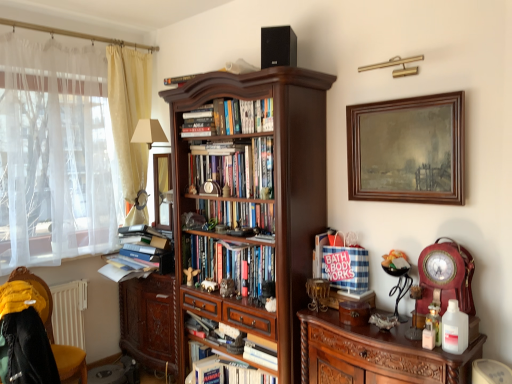
What is the approximate height of transparent plastic bottle at right?

It is 7.89 inches.

What do you see at coordinates (237, 169) in the screenshot? The width and height of the screenshot is (512, 384). I see `hardcover books at center, arranged as the second book when viewed from the top` at bounding box center [237, 169].

What do you see at coordinates (150, 321) in the screenshot? The image size is (512, 384). I see `carved wood cabinet at lower left` at bounding box center [150, 321].

Locate an element on the screen. The image size is (512, 384). transparent plastic bottle at right is located at coordinates (455, 329).

Considering the sizes of wooden clock at right, the 2th picture frame when ordered from top to bottom, and brown carved wooden cabinet at lower right in the image, is wooden clock at right, the 2th picture frame when ordered from top to bottom, taller or shorter than brown carved wooden cabinet at lower right?

In the image, wooden clock at right, the 2th picture frame when ordered from top to bottom, appears to be shorter than brown carved wooden cabinet at lower right.

The height and width of the screenshot is (384, 512). Find the location of `cabinetry below the wooden clock at right, the 2th picture frame when ordered from top to bottom (from a real-world perspective)`. cabinetry below the wooden clock at right, the 2th picture frame when ordered from top to bottom (from a real-world perspective) is located at coordinates (375, 355).

Is wooden clock at right, the 2th picture frame when ordered from top to bottom, with brown carved wooden cabinet at lower right?

No, wooden clock at right, the 2th picture frame when ordered from top to bottom, is not next to brown carved wooden cabinet at lower right.

Can you confirm if hardcover books at center, the 5th book from the top, is taller than yellow fabric chair at lower left?

Incorrect, the height of hardcover books at center, the 5th book from the top, is not larger of that of yellow fabric chair at lower left.

Is hardcover books at center, the first book ordered from the bottom, aimed at yellow fabric chair at lower left?

No, hardcover books at center, the first book ordered from the bottom, is not oriented towards yellow fabric chair at lower left.

Is hardcover books at center, the first book ordered from the bottom, outside of yellow fabric chair at lower left?

Yes, hardcover books at center, the first book ordered from the bottom, is not within yellow fabric chair at lower left.

Considering the points (218, 374) and (287, 36), which point is behind, point (218, 374) or point (287, 36)?

Positioned behind is point (218, 374).

Looking at this image, which of these two, hardcover books at center, the first book ordered from the bottom, or black matte speaker at upper center, is smaller?

hardcover books at center, the first book ordered from the bottom, is smaller.

Is hardcover books at center, the first book ordered from the bottom, beside black matte speaker at upper center?

No.

Would you say black matte speaker at upper center is part of hardcover books at center, the 5th book from the top,'s contents?

No, black matte speaker at upper center is located outside of hardcover books at center, the 5th book from the top.

Which of these two, wooden clock at right, which is the 1th picture frame from bottom to top, or hardcover books at center, acting as the 3th book starting from the bottom, is thinner?

wooden clock at right, which is the 1th picture frame from bottom to top, is thinner.

Which of these two, wooden clock at right, the 2th picture frame when ordered from top to bottom, or hardcover books at center, which is counted as the third book, starting from the top, is smaller?

wooden clock at right, the 2th picture frame when ordered from top to bottom.

Is wooden clock at right, the 2th picture frame when ordered from top to bottom, far away from hardcover books at center, which is counted as the third book, starting from the top?

wooden clock at right, the 2th picture frame when ordered from top to bottom, is near hardcover books at center, which is counted as the third book, starting from the top, not far away.

From a real-world perspective, is wooden clock at right, the 2th picture frame when ordered from top to bottom, above or below hardcover books at center, which is counted as the third book, starting from the top?

wooden clock at right, the 2th picture frame when ordered from top to bottom, is below hardcover books at center, which is counted as the third book, starting from the top.

Is hardcover books at center, which appears as the fifth book when ordered from the bottom, aimed at black matte speaker at upper center?

No, hardcover books at center, which appears as the fifth book when ordered from the bottom, does not turn towards black matte speaker at upper center.

Is hardcover books at center, which is counted as the first book, starting from the top, shorter than black matte speaker at upper center?

Yes.

From the picture: Are hardcover books at center, which is counted as the first book, starting from the top, and black matte speaker at upper center making contact?

No, hardcover books at center, which is counted as the first book, starting from the top, is not in contact with black matte speaker at upper center.

Would you say hardcover books at center, which appears as the fifth book when ordered from the bottom, is inside or outside black matte speaker at upper center?

hardcover books at center, which appears as the fifth book when ordered from the bottom, lies outside black matte speaker at upper center.

Is dark wood bookcase at center facing away from transparent glass window screen at left?

No, transparent glass window screen at left is not at the back of dark wood bookcase at center.

From the image's perspective, would you say dark wood bookcase at center is shown under transparent glass window screen at left?

Yes, from the image's perspective, dark wood bookcase at center is below transparent glass window screen at left.

Considering the sizes of objects dark wood bookcase at center and transparent glass window screen at left in the image provided, who is smaller, dark wood bookcase at center or transparent glass window screen at left?

transparent glass window screen at left is smaller.

Based on the photo, from a real-world perspective, is dark wood bookcase at center positioned over transparent glass window screen at left based on gravity?

Actually, dark wood bookcase at center is physically below transparent glass window screen at left in the real world.

Could wooden clock at right, the 2th picture frame when ordered from top to bottom, be considered to be inside hardcover books at center, which appears as the fifth book when ordered from the bottom?

Definitely not — wooden clock at right, the 2th picture frame when ordered from top to bottom, is not inside hardcover books at center, which appears as the fifth book when ordered from the bottom.

Is hardcover books at center, which is counted as the first book, starting from the top, next to wooden clock at right, which is the 1th picture frame from bottom to top, and touching it?

hardcover books at center, which is counted as the first book, starting from the top, and wooden clock at right, which is the 1th picture frame from bottom to top, are not in contact.

Visually, is hardcover books at center, which appears as the fifth book when ordered from the bottom, positioned to the left or to the right of wooden clock at right, which is the 1th picture frame from bottom to top?

hardcover books at center, which appears as the fifth book when ordered from the bottom, is to the left of wooden clock at right, which is the 1th picture frame from bottom to top.

I want to click on the 2nd picture frame counting from the right of the hardcover books at center, which is counted as the first book, starting from the top, so click(446, 276).

The image size is (512, 384). In order to click on cabinetry on the left of wooden clock at right, which is the 1th picture frame from bottom to top in this screenshot , I will do `click(375, 355)`.

From the yellow fabric chair at lower left, count 3rd books backward and point to it. Please provide its 2D coordinates.

[(226, 369)]

Considering their positions, is wooden framed painting at upper right, marked as the second picture frame in a bottom-to-top arrangement, positioned further to wooden clock at right, which is the 1th picture frame from bottom to top, than yellow fabric curtain at left, marked as the second curtain in a left-to-right arrangement?

yellow fabric curtain at left, marked as the second curtain in a left-to-right arrangement.

Estimate the real-world distances between objects in this image. Which object is further from black matte speaker at upper center, carved wood cabinet at lower left or dark wood bookcase at center?

carved wood cabinet at lower left lies further to black matte speaker at upper center than the other object.

From the picture: Based on their spatial positions, is hardcover books at center, which is counted as the third book, starting from the top, or transparent plastic bottle at right closer to hardcover books at center, which appears as the second book when ordered from the bottom?

Based on the image, hardcover books at center, which is counted as the third book, starting from the top, appears to be nearer to hardcover books at center, which appears as the second book when ordered from the bottom.

When comparing their distances from hardcover books at center, the 5th book from the top, does hardcover books at center, which is counted as the third book, starting from the top, or brown carved wooden cabinet at lower right seem closer?

The object closer to hardcover books at center, the 5th book from the top, is brown carved wooden cabinet at lower right.

When comparing their distances from wooden framed painting at upper right, marked as the second picture frame in a bottom-to-top arrangement, does black matte speaker at upper center or wooden clock at right, the 2th picture frame when ordered from top to bottom, seem closer?

Based on the image, wooden clock at right, the 2th picture frame when ordered from top to bottom, appears to be nearer to wooden framed painting at upper right, marked as the second picture frame in a bottom-to-top arrangement.

Consider the image. When comparing their distances from dark wood bookcase at center, does black matte speaker at upper center or hardcover books at center, placed as the fourth book when sorted from bottom to top, seem further?

Among the two, black matte speaker at upper center is located further to dark wood bookcase at center.

Estimate the real-world distances between objects in this image. Which object is further from transparent glass window screen at left, hardcover books at center, acting as the 3th book starting from the bottom, or yellow fabric curtain at left, the first curtain viewed from the right?

hardcover books at center, acting as the 3th book starting from the bottom.

Based on their spatial positions, is brown carved wooden cabinet at lower right or carved wood cabinet at lower left further from white sheer curtain at left, the 2th curtain when ordered from right to left?

brown carved wooden cabinet at lower right.

Identify the location of window screen that lies between yellow fabric curtain at left, marked as the second curtain in a left-to-right arrangement, and hardcover books at center, the first book ordered from the bottom, from top to bottom. (162, 190).

Identify the location of bookcase between wooden clock at right, which is the 1th picture frame from bottom to top, and transparent glass window screen at left in the front-back direction. The width and height of the screenshot is (512, 384). (251, 201).

Find the location of a particular element. The height and width of the screenshot is (384, 512). bookcase between black matte speaker at upper center and transparent plastic bottle at right in the vertical direction is located at coordinates (251, 201).

Identify the location of book between hardcover books at center, acting as the 3th book starting from the bottom, and carved wood cabinet at lower left vertically. This screenshot has height=384, width=512. (229, 261).